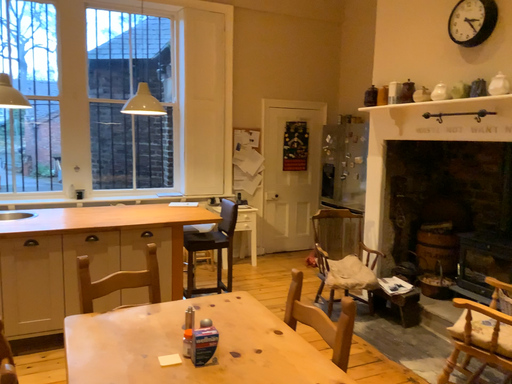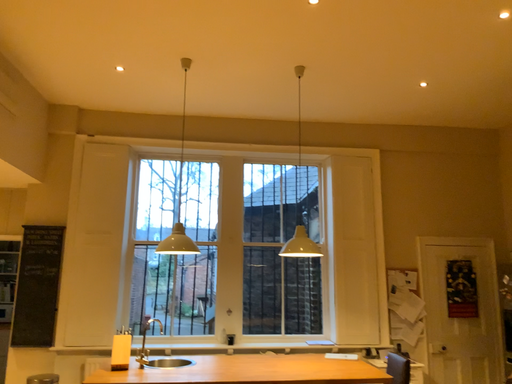
Question: Which way did the camera rotate in the video?

Choices:
 (A) rotated downward
 (B) rotated upward

Answer: (B)